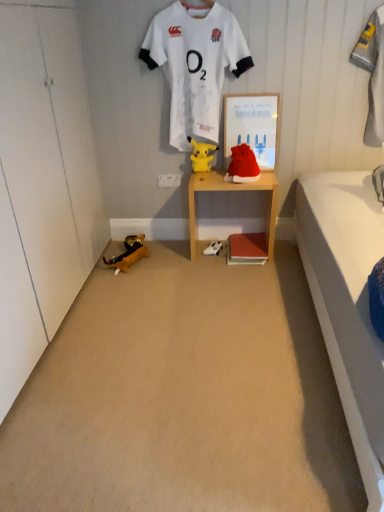
This screenshot has width=384, height=512. Find the location of `free space between yellow plush toy at lower left, which is the 3th toy from top to bottom, and white fabric shoe at lower center`. free space between yellow plush toy at lower left, which is the 3th toy from top to bottom, and white fabric shoe at lower center is located at coordinates (x=170, y=252).